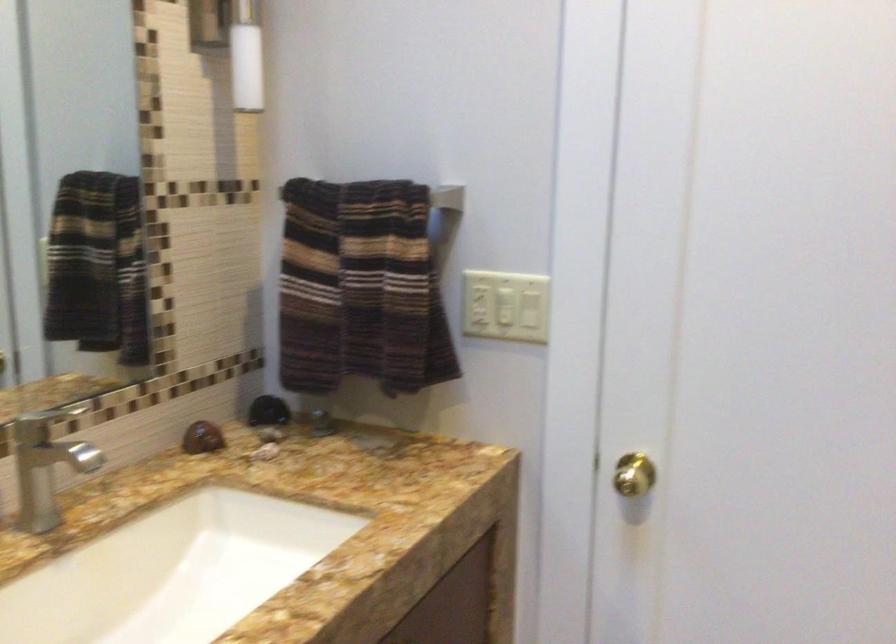
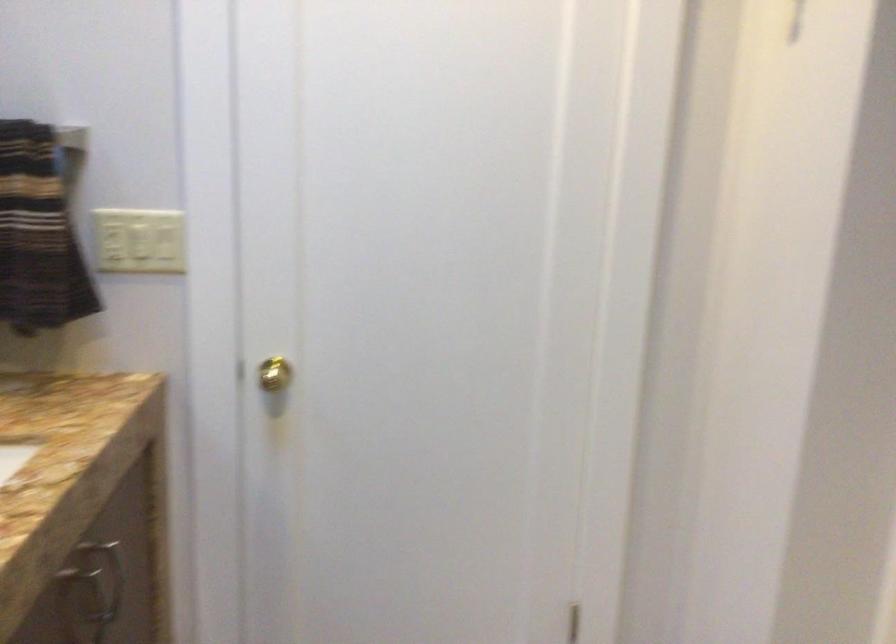
Question: The camera is either moving clockwise (left) or counter-clockwise (right) around the object. The first image is from the beginning of the video and the second image is from the end. Is the camera moving left or right when shooting the video?

Choices:
 (A) Left
 (B) Right

Answer: (A)